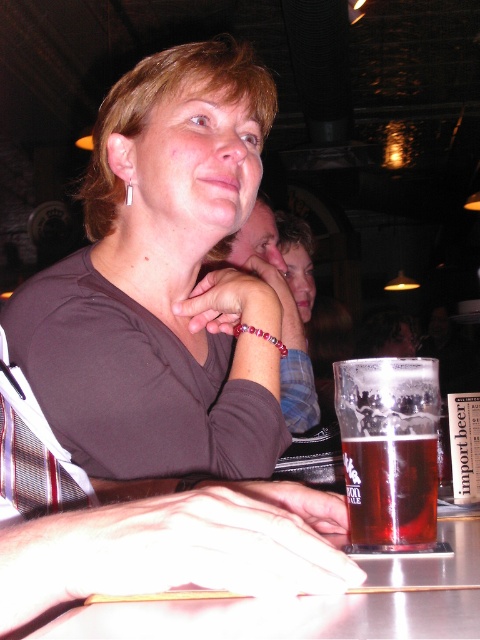
Which is above, metallic silver table at lower center or matte blue shirt at center?

matte blue shirt at center

Locate an element on the screen. metallic silver table at lower center is located at coordinates (312, 604).

Is metallic silver table at lower center to the left of translucent glass mug at center from the viewer's perspective?

Indeed, metallic silver table at lower center is positioned on the left side of translucent glass mug at center.

From the picture: Between metallic silver table at lower center and translucent glass mug at center, which one has more height?

Standing taller between the two is translucent glass mug at center.

Image resolution: width=480 pixels, height=640 pixels. I want to click on metallic silver table at lower center, so click(x=312, y=604).

Does matte brown shirt at center have a larger size compared to metallic silver table at lower center?

Indeed, matte brown shirt at center has a larger size compared to metallic silver table at lower center.

Does point (109, 310) lie in front of point (208, 604)?

No.

Between point (189, 113) and point (435, 570), which one is positioned in front?

Point (435, 570) is more forward.

Identify the location of matte brown shirt at center. The height and width of the screenshot is (640, 480). (156, 365).